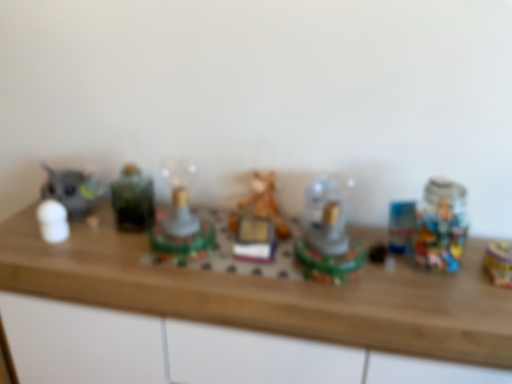
At what (x,y) coordinates should I click in order to perform the action: click on free space in front of shiny green plastic toy at center, marked as the fourth toy in a right-to-left arrangement. Please return your answer as a coordinate pair (x, y). The height and width of the screenshot is (384, 512). Looking at the image, I should click on (173, 278).